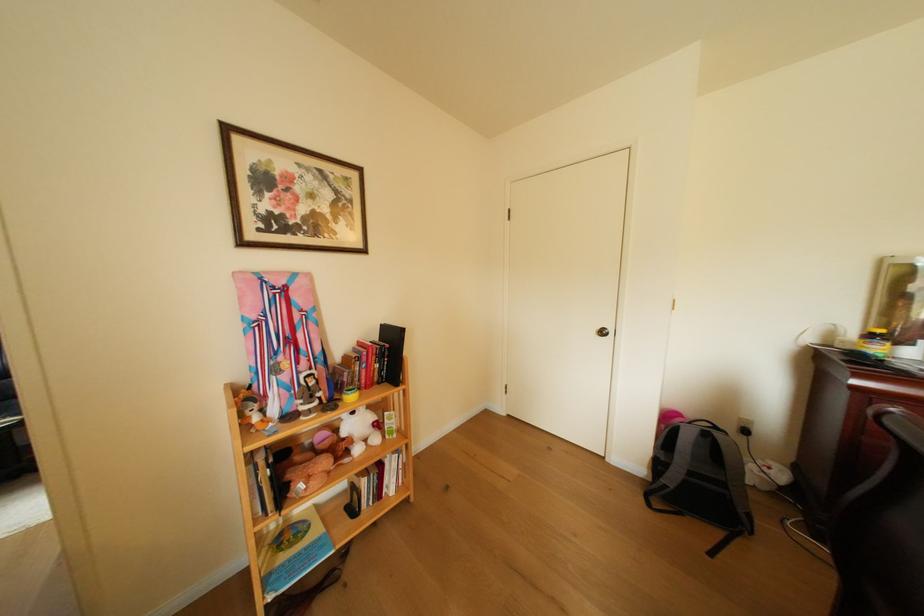
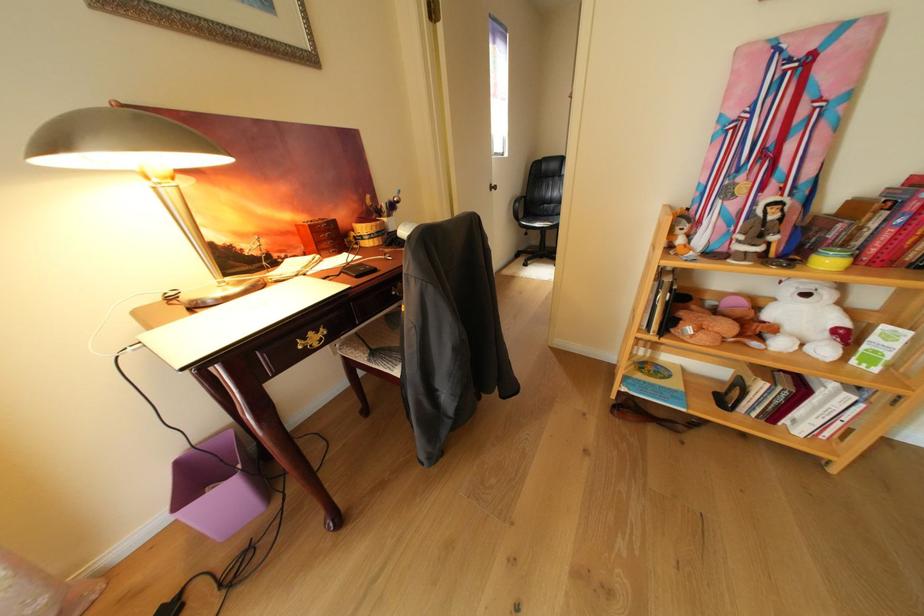
Where in the second image is the point corresponding to (x=353, y=406) from the first image?

(811, 267)